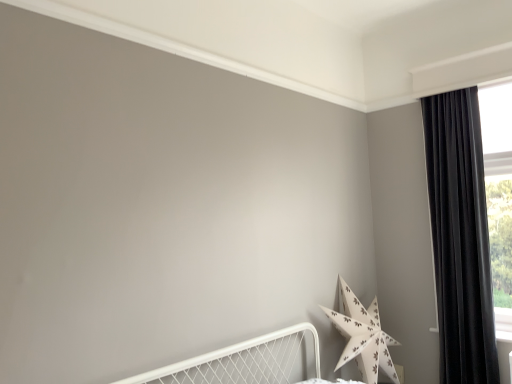
Question: Is black velvet curtain at right closer to the viewer compared to white paper star at lower right?

Choices:
 (A) yes
 (B) no

Answer: (B)

Question: Can you confirm if black velvet curtain at right is taller than white paper star at lower right?

Choices:
 (A) yes
 (B) no

Answer: (A)

Question: From the image's perspective, would you say black velvet curtain at right is positioned over white paper star at lower right?

Choices:
 (A) no
 (B) yes

Answer: (B)

Question: Is black velvet curtain at right aimed at white paper star at lower right?

Choices:
 (A) no
 (B) yes

Answer: (A)

Question: Does black velvet curtain at right have a lesser width compared to white paper star at lower right?

Choices:
 (A) no
 (B) yes

Answer: (B)

Question: Can you confirm if black velvet curtain at right is positioned to the right of white paper star at lower right?

Choices:
 (A) no
 (B) yes

Answer: (B)

Question: Does white paper star at lower right have a larger size compared to black velvet curtain at right?

Choices:
 (A) no
 (B) yes

Answer: (B)

Question: Are white paper star at lower right and black velvet curtain at right far apart?

Choices:
 (A) yes
 (B) no

Answer: (B)

Question: Does white paper star at lower right have a lesser height compared to black velvet curtain at right?

Choices:
 (A) yes
 (B) no

Answer: (A)

Question: From a real-world perspective, is white paper star at lower right positioned over black velvet curtain at right based on gravity?

Choices:
 (A) yes
 (B) no

Answer: (B)

Question: Does white paper star at lower right contain black velvet curtain at right?

Choices:
 (A) no
 (B) yes

Answer: (A)

Question: Are white paper star at lower right and black velvet curtain at right making contact?

Choices:
 (A) no
 (B) yes

Answer: (A)

Question: Do you think black velvet curtain at right is within white paper star at lower right, or outside of it?

Choices:
 (A) inside
 (B) outside

Answer: (B)